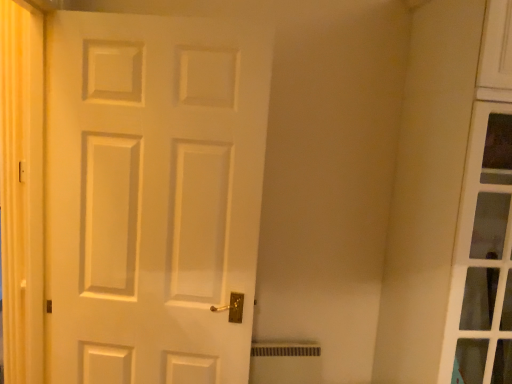
Question: In terms of size, does white matte door at center appear bigger or smaller than yellow fabric curtain at left?

Choices:
 (A) small
 (B) big

Answer: (B)

Question: Is white matte door at center to the left or to the right of yellow fabric curtain at left in the image?

Choices:
 (A) right
 (B) left

Answer: (A)

Question: From the image's perspective, relative to yellow fabric curtain at left, is white matte door at center above or below?

Choices:
 (A) above
 (B) below

Answer: (B)

Question: Choose the correct answer: Is yellow fabric curtain at left inside white matte door at center or outside it?

Choices:
 (A) inside
 (B) outside

Answer: (B)

Question: From the image's perspective, is yellow fabric curtain at left above or below white matte door at center?

Choices:
 (A) below
 (B) above

Answer: (B)

Question: Visually, is yellow fabric curtain at left positioned to the left or to the right of white matte door at center?

Choices:
 (A) right
 (B) left

Answer: (B)

Question: Based on their sizes in the image, would you say yellow fabric curtain at left is bigger or smaller than white matte door at center?

Choices:
 (A) big
 (B) small

Answer: (B)